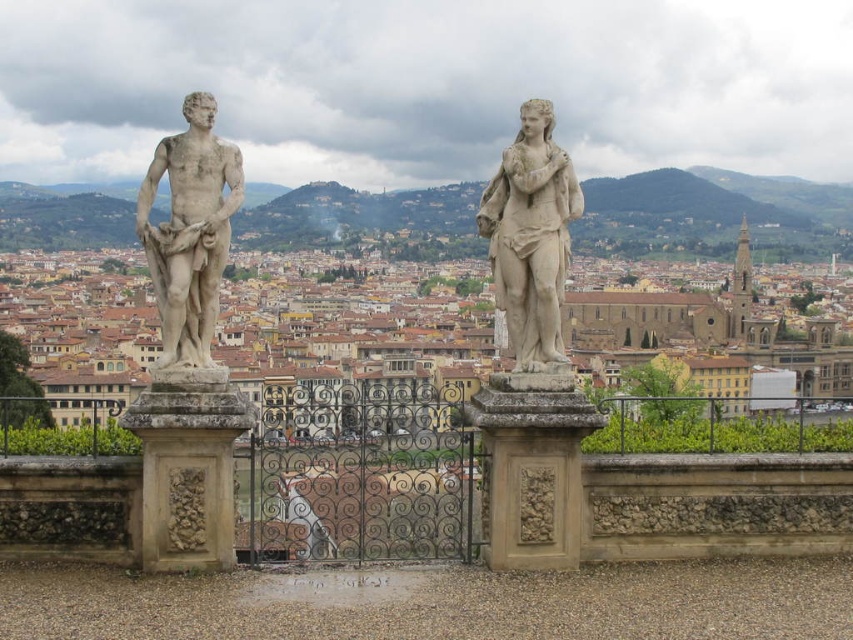
You are standing on a terrace overlooking a city and want to know how far you are from the point marked as point (192, 323). Can you determine the distance?

The distance between you and point (192, 323) is 118.58 feet.

You are an art conservator assessing the statues on a terrace. The statues are the white marble statue at left and the white marble statue at center. Which statue has a smaller width?

The white marble statue at left has a lesser width compared to the white marble statue at center.

You are an architect designing a new garden layout. You need to place a new bench between the white marble statue at left and the white marble statue at center. However, the statues are positioned in a way that might block the bench placement. Based on their positions, can you place the bench between them without obstruction?

Answer: The white marble statue at left is positioned over the white marble statue at center, meaning they are stacked vertically rather than placed side by side. Therefore, you cannot place a bench between them horizontally as they occupy the same horizontal space.